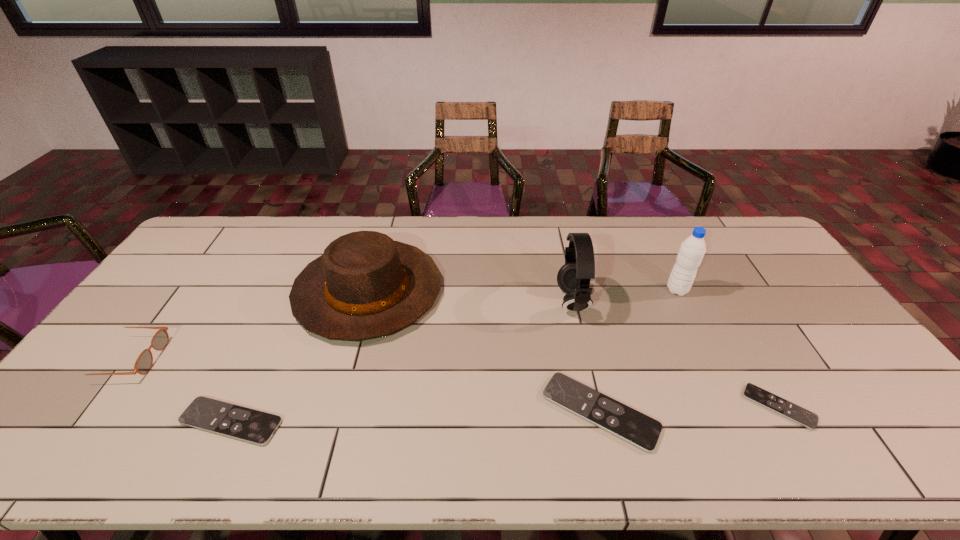
Please determine a free point for an extra remote_control to ensure balance. Please provide its 2D coordinates. Your answer should be formatted as a tuple, i.e. [(x, y)], where the tuple contains the x and y coordinates of a point satisfying the conditions above.

[(418, 416)]